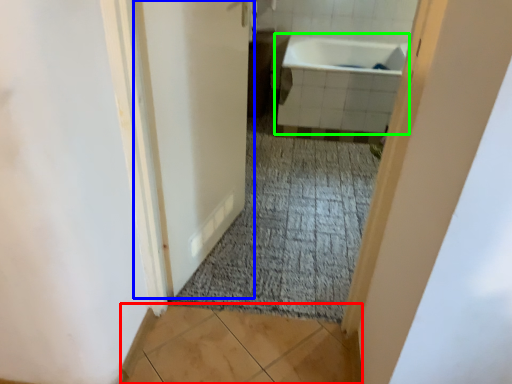
Question: Which is nearer to the tile (highlighted by a red box)? door (highlighted by a blue box) or bathtub (highlighted by a green box).

Choices:
 (A) door
 (B) bathtub

Answer: (A)